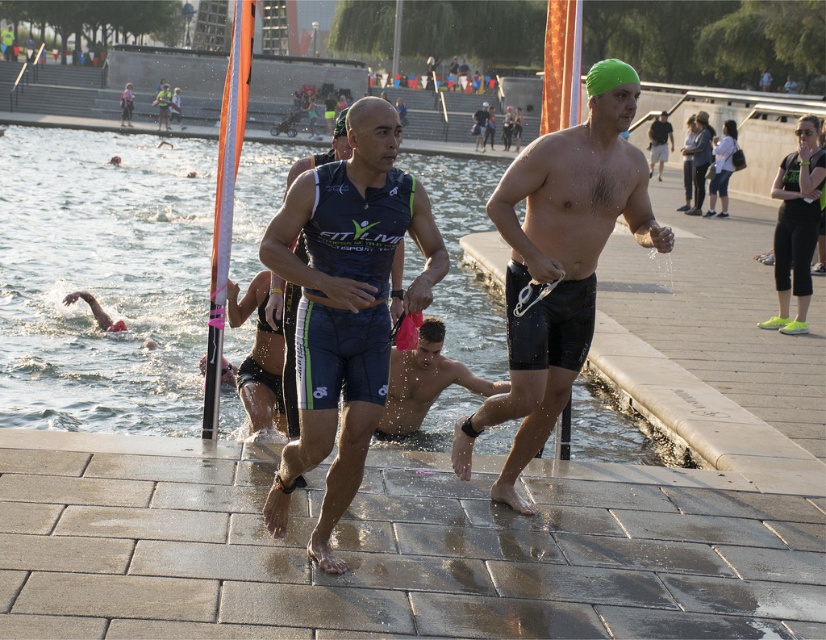
Which of these two, green swim cap at center or green matte swim cap at upper right, stands taller?

Standing taller between the two is green swim cap at center.

Is green swim cap at center wider than green matte swim cap at upper right?

Yes, green swim cap at center is wider than green matte swim cap at upper right.

This screenshot has height=640, width=826. I want to click on green swim cap at center, so (558, 269).

Who is positioned more to the left, blue athletic suit at center or shiny wet skin at center?

Positioned to the left is blue athletic suit at center.

Does point (330, 394) lie behind point (430, 339)?

No, (330, 394) is closer to viewer.

Who is more forward, (355, 476) or (406, 362)?

Point (355, 476) is more forward.

This screenshot has height=640, width=826. I want to click on blue athletic suit at center, so click(x=345, y=305).

Does green swim cap at center have a greater width compared to shiny wet skin at center?

Correct, the width of green swim cap at center exceeds that of shiny wet skin at center.

Who is shorter, green swim cap at center or shiny wet skin at center?

Standing shorter between the two is shiny wet skin at center.

Who is more distant from viewer, (546, 307) or (420, 324)?

The point (420, 324) is more distant.

I want to click on green swim cap at center, so click(558, 269).